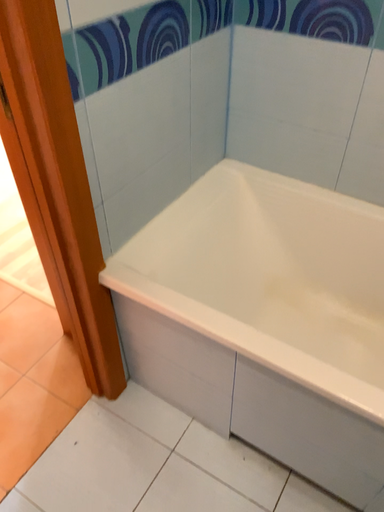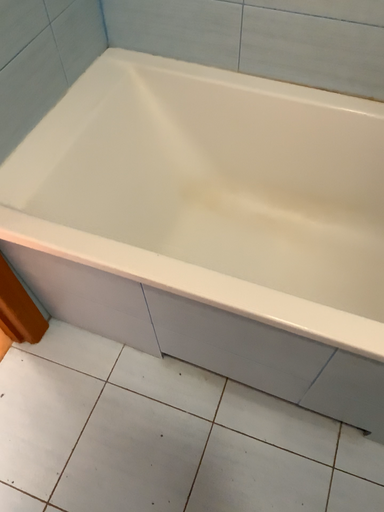
Question: Which way did the camera rotate in the video?

Choices:
 (A) rotated left
 (B) rotated right

Answer: (B)